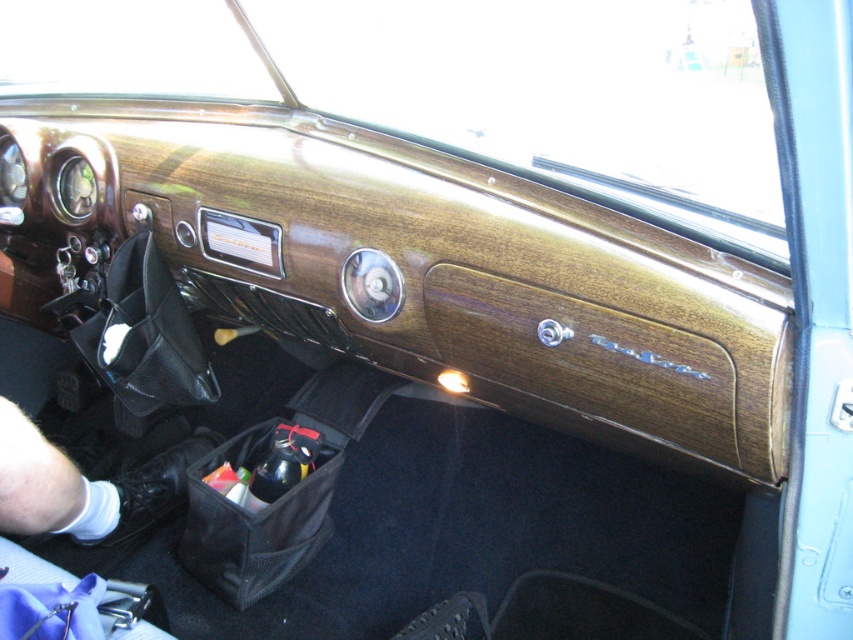
You are a passenger in the vintage car and want to place a small black mesh bag at lower center. Where should you place it?

You should place the black mesh bag at lower center at point (x=254, y=522).

You are a passenger in the vintage car and need to store your belongings. You have a black mesh bag at lower center and a black leather glove at lower left. Which object is located lower in the dashboard area?

The black mesh bag at lower center is positioned under the black leather glove at lower left, so it is located lower in the dashboard area.

You are a mechanic working on a vintage car and need to place a tool box that is 12 inches wide between the black mesh bag at lower center and the black leather glove at lower left. Based on the scene description, will the tool box fit in the space between them?

The distance between the black mesh bag at lower center and the black leather glove at lower left is 10.00 inches. Since the tool box is 12 inches wide, it will not fit in the space between them.